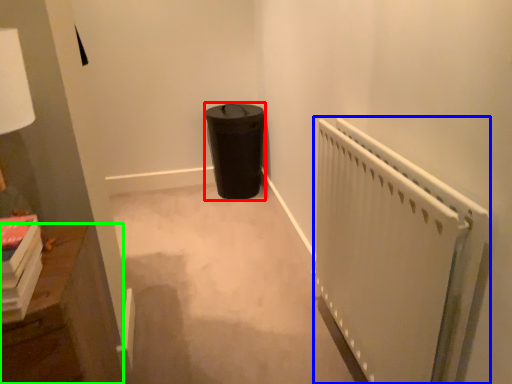
Question: Which is farther away from garbage (highlighted by a red box)? radiator (highlighted by a blue box) or furniture (highlighted by a green box)?

Choices:
 (A) radiator
 (B) furniture

Answer: (B)